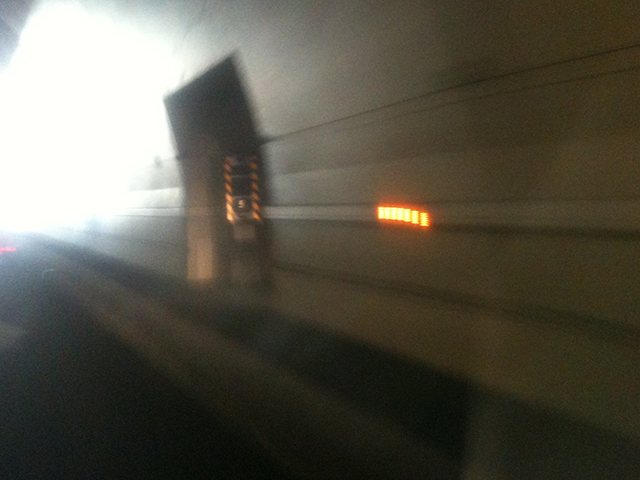
Locate an element on the screen. strips on wall is located at coordinates (504, 80), (516, 213), (514, 308), (162, 246).